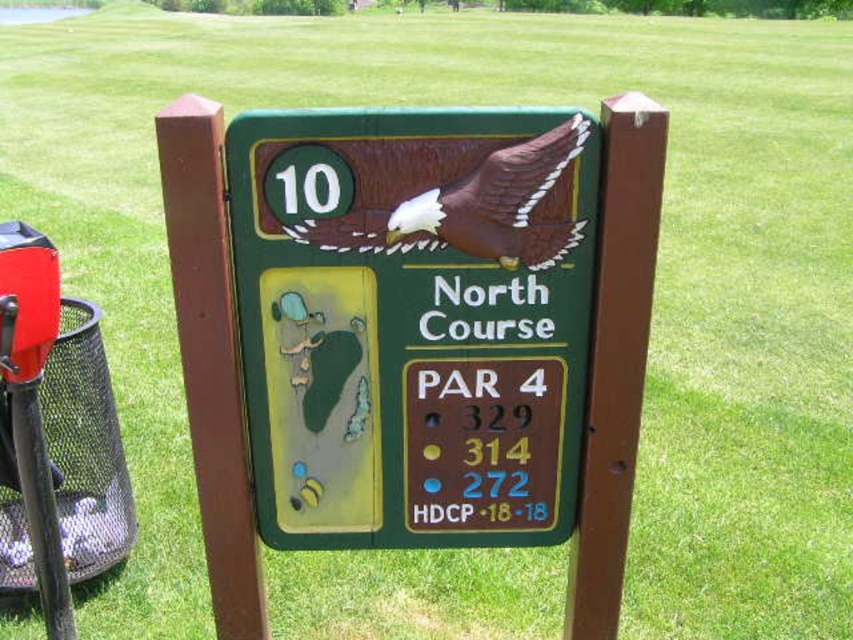
Question: Which point is farther from the camera taking this photo?

Choices:
 (A) (299, 232)
 (B) (283, 116)

Answer: (A)

Question: From the image, what is the correct spatial relationship of green matte sign at center in relation to brown wood post at center?

Choices:
 (A) right
 (B) left

Answer: (A)

Question: Can you confirm if green matte sign at center is thinner than brown matte eagle at center?

Choices:
 (A) no
 (B) yes

Answer: (A)

Question: Among these objects, which one is nearest to the camera?

Choices:
 (A) brown wood post at center
 (B) green matte sign at center
 (C) brown matte eagle at center

Answer: (A)

Question: Which point is farther to the camera?

Choices:
 (A) green matte sign at center
 (B) brown matte eagle at center
 (C) brown wood post at center

Answer: (B)

Question: Is green matte sign at center thinner than brown matte eagle at center?

Choices:
 (A) no
 (B) yes

Answer: (A)